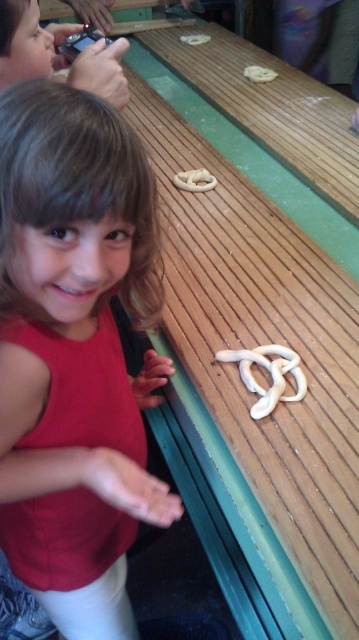
Question: Which of the following is the closest to the observer?

Choices:
 (A) (290, 442)
 (B) (50, 225)

Answer: (B)

Question: Observing the image, what is the correct spatial positioning of wooden picnic table at center in reference to matte red shirt at center?

Choices:
 (A) below
 (B) above

Answer: (B)

Question: Is wooden picnic table at center to the right of matte red shirt at center from the viewer's perspective?

Choices:
 (A) no
 (B) yes

Answer: (B)

Question: Is wooden picnic table at center to the left of matte red shirt at center from the viewer's perspective?

Choices:
 (A) yes
 (B) no

Answer: (B)